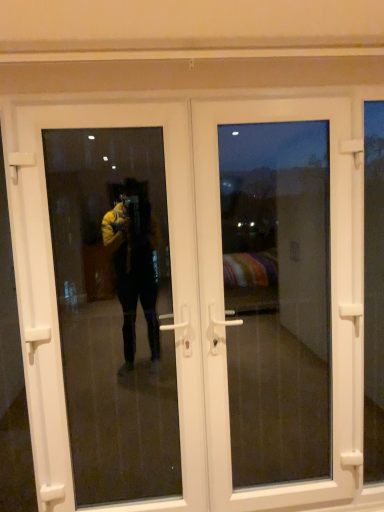
What are the coordinates of `free spot above transparent glass door at left (from a real-world perspective)` in the screenshot? It's located at (82, 98).